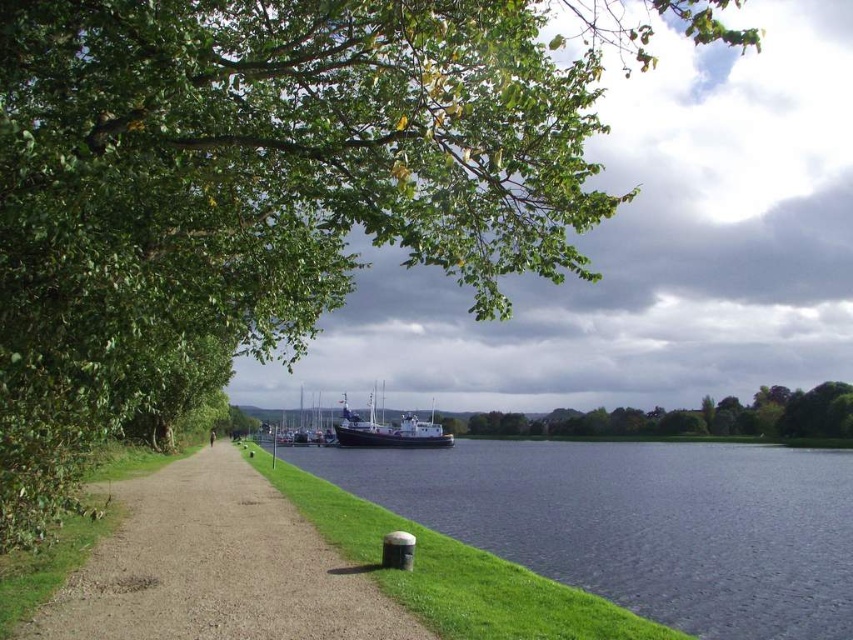
Is dirt/gravel path at lower left positioned before green leafy tree at center?

Yes, dirt/gravel path at lower left is in front of green leafy tree at center.

Who is positioned more to the right, dirt/gravel path at lower left or green leafy tree at center?

green leafy tree at center

Which is in front, point (131, 620) or point (606, 417)?

Point (131, 620) is more forward.

Find the location of a particular element. The image size is (853, 640). dirt/gravel path at lower left is located at coordinates (215, 566).

Does dark blue water at lower center appear under white wooden boat at center?

Yes, dark blue water at lower center is below white wooden boat at center.

Which is in front, point (780, 525) or point (428, 448)?

Point (780, 525) is in front.

Image resolution: width=853 pixels, height=640 pixels. Identify the location of dark blue water at lower center. (639, 522).

The image size is (853, 640). Find the location of `dirt/gravel path at lower left`. dirt/gravel path at lower left is located at coordinates (215, 566).